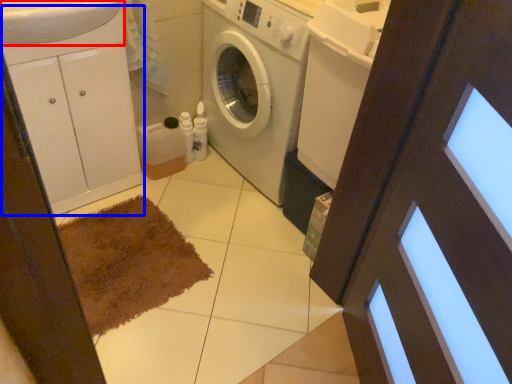
Question: Which object appears farthest to the camera in this image, sink (highlighted by a red box) or cabinetry (highlighted by a blue box)?

Choices:
 (A) sink
 (B) cabinetry

Answer: (B)